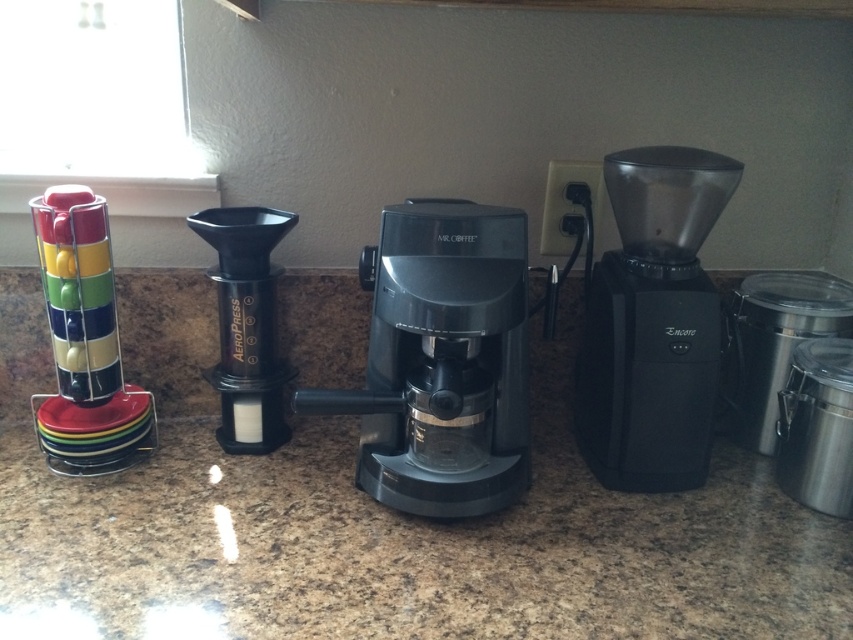
Question: Does granite countertop at center come in front of multicolored plastic cups at left?

Choices:
 (A) yes
 (B) no

Answer: (A)

Question: Is black plastic coffee machine at center positioned in front of black plastic coffee grinder at right?

Choices:
 (A) no
 (B) yes

Answer: (B)

Question: Which object is positioned closest to the black matte aeropress at center?

Choices:
 (A) granite countertop at center
 (B) black plastic coffee grinder at right

Answer: (A)

Question: Which object appears closest to the camera in this image?

Choices:
 (A) black plastic coffee machine at center
 (B) black plastic coffee grinder at right

Answer: (A)

Question: Can you confirm if black plastic coffee machine at center is positioned to the left of black matte aeropress at center?

Choices:
 (A) yes
 (B) no

Answer: (B)

Question: Which object is the closest to the black plastic coffee grinder at right?

Choices:
 (A) granite countertop at center
 (B) black matte aeropress at center

Answer: (A)